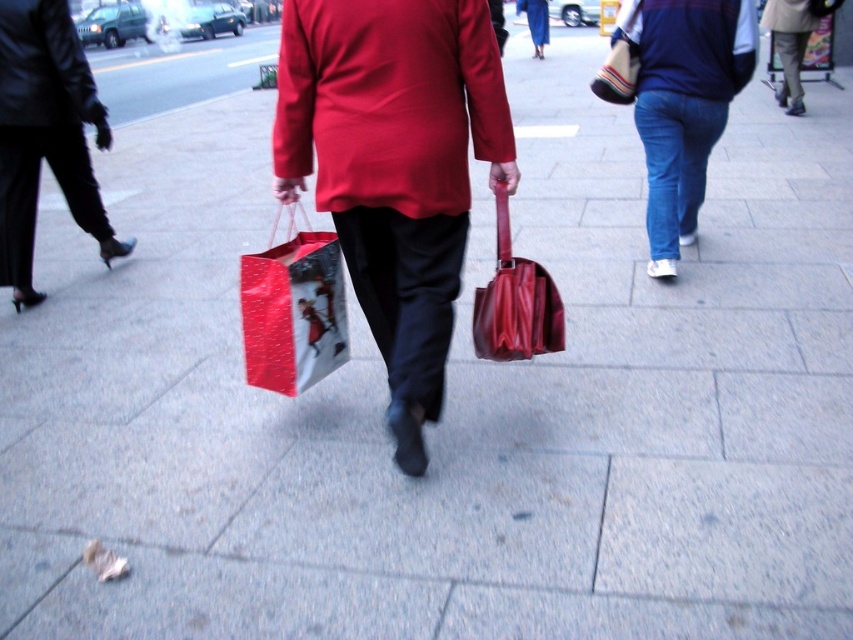
Question: Can you confirm if denim jeans at right is positioned below shiny paper bag at center?

Choices:
 (A) yes
 (B) no

Answer: (B)

Question: Among these points, which one is nearest to the camera?

Choices:
 (A) (332, 211)
 (B) (289, 346)
 (C) (115, 241)

Answer: (A)

Question: Observing the image, what is the correct spatial positioning of matte red sweatshirt at center in reference to blue cotton sweatshirt at upper right?

Choices:
 (A) left
 (B) right

Answer: (A)

Question: Which of these objects is positioned farthest from the glossy leather handbag at center?

Choices:
 (A) matte red sweatshirt at center
 (B) black leather pants at left
 (C) denim jeans at right

Answer: (B)

Question: Which is farther from the matte red jacket at center?

Choices:
 (A) blue cotton sweatshirt at upper right
 (B) striped fabric bag at upper right
 (C) denim jeans at right
 (D) glossy leather handbag at center

Answer: (C)

Question: Does matte red jacket at center have a greater width compared to black leather pants at left?

Choices:
 (A) no
 (B) yes

Answer: (B)